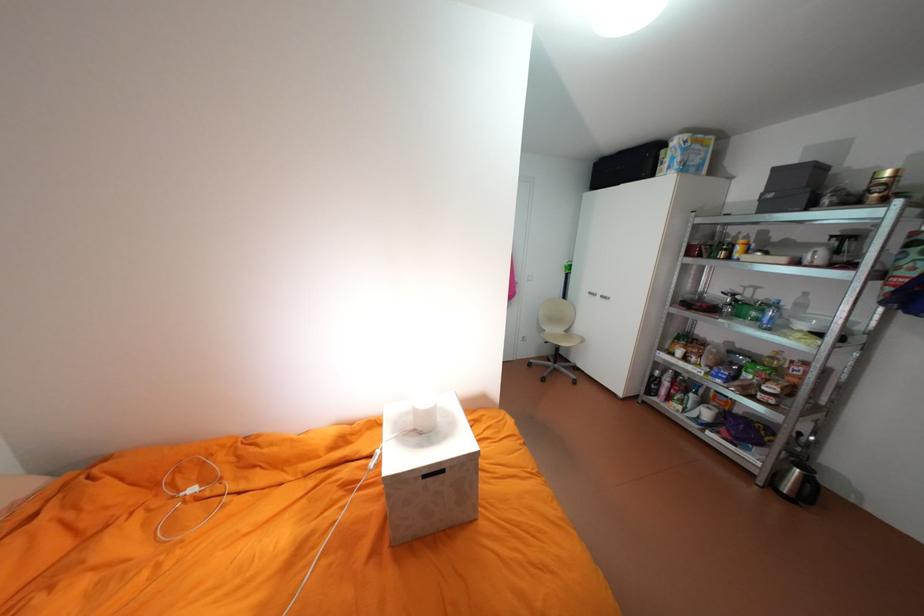
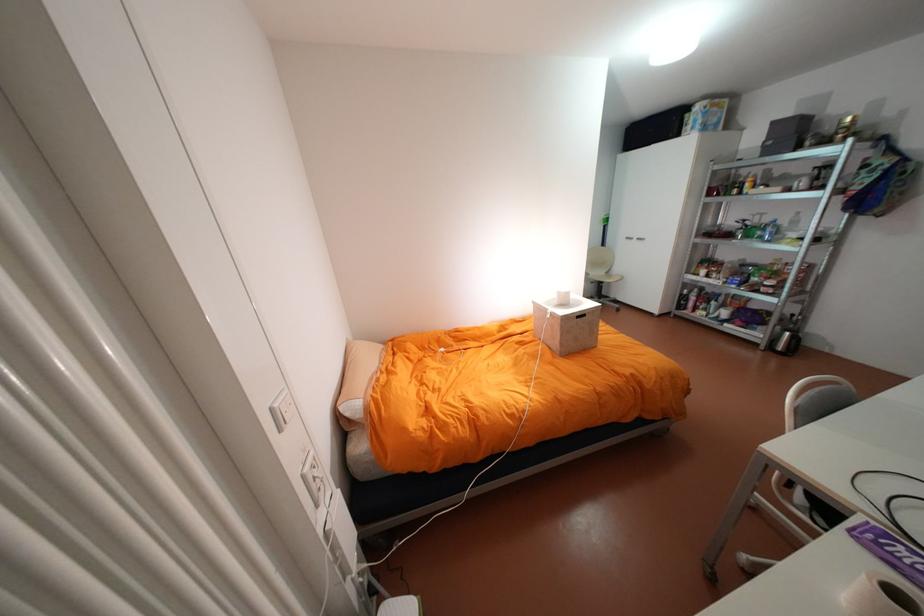
In the second image, find the point that corresponds to point 599,292 in the first image.

(636, 237)